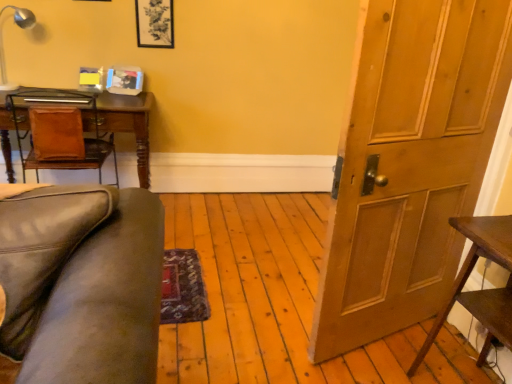
Question: Is dark brown wooden table at right bigger than matte black picture frame at upper center?

Choices:
 (A) no
 (B) yes

Answer: (B)

Question: Is dark brown wooden table at right not within matte black picture frame at upper center?

Choices:
 (A) no
 (B) yes

Answer: (B)

Question: Can you confirm if dark brown wooden table at right is shorter than matte black picture frame at upper center?

Choices:
 (A) yes
 (B) no

Answer: (B)

Question: Is matte black picture frame at upper center at the back of dark brown wooden table at right?

Choices:
 (A) yes
 (B) no

Answer: (B)

Question: Is dark brown wooden table at right further to camera compared to matte black picture frame at upper center?

Choices:
 (A) yes
 (B) no

Answer: (B)

Question: Would you say dark brown wooden table at right is a long distance from matte black picture frame at upper center?

Choices:
 (A) no
 (B) yes

Answer: (B)

Question: Does metallic silver lamp at upper left have a smaller size compared to matte black picture frame at upper center?

Choices:
 (A) no
 (B) yes

Answer: (A)

Question: Can you confirm if metallic silver lamp at upper left is positioned to the left of matte black picture frame at upper center?

Choices:
 (A) no
 (B) yes

Answer: (B)

Question: Can you confirm if metallic silver lamp at upper left is taller than matte black picture frame at upper center?

Choices:
 (A) no
 (B) yes

Answer: (B)

Question: Can we say metallic silver lamp at upper left lies outside matte black picture frame at upper center?

Choices:
 (A) yes
 (B) no

Answer: (A)

Question: From a real-world perspective, is metallic silver lamp at upper left located beneath matte black picture frame at upper center?

Choices:
 (A) no
 (B) yes

Answer: (B)

Question: From the image's perspective, is metallic silver lamp at upper left on top of matte black picture frame at upper center?

Choices:
 (A) yes
 (B) no

Answer: (B)

Question: Considering the relative sizes of dark brown wooden table at right and wooden door at right in the image provided, is dark brown wooden table at right wider than wooden door at right?

Choices:
 (A) yes
 (B) no

Answer: (A)